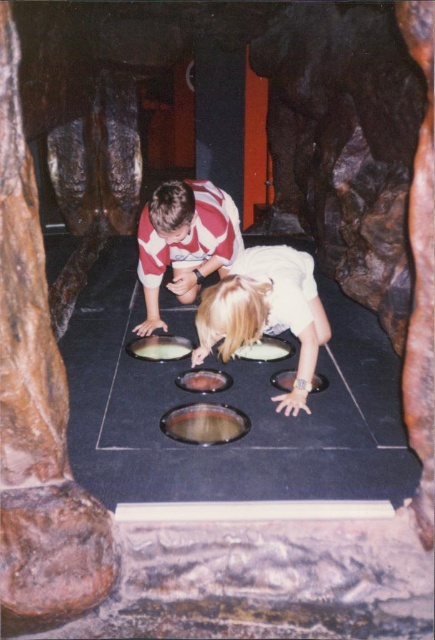
You are a parent supervising children at a museum exhibit with two types of food samples displayed. The exhibit has a dark floor with six green liquid pools. You notice the children are curious about the white matte food at center and the brown matte food at center. Which food sample should you caution them not to touch based on their sizes?

The white matte food at center is bigger than the brown matte food at center, so you should caution them not to touch the white matte food at center as it is larger and may pose a choking hazard.